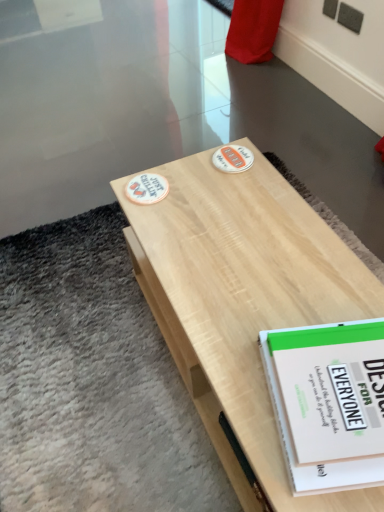
In order to click on free location to the left of white paper book at center in this screenshot , I will do `click(234, 373)`.